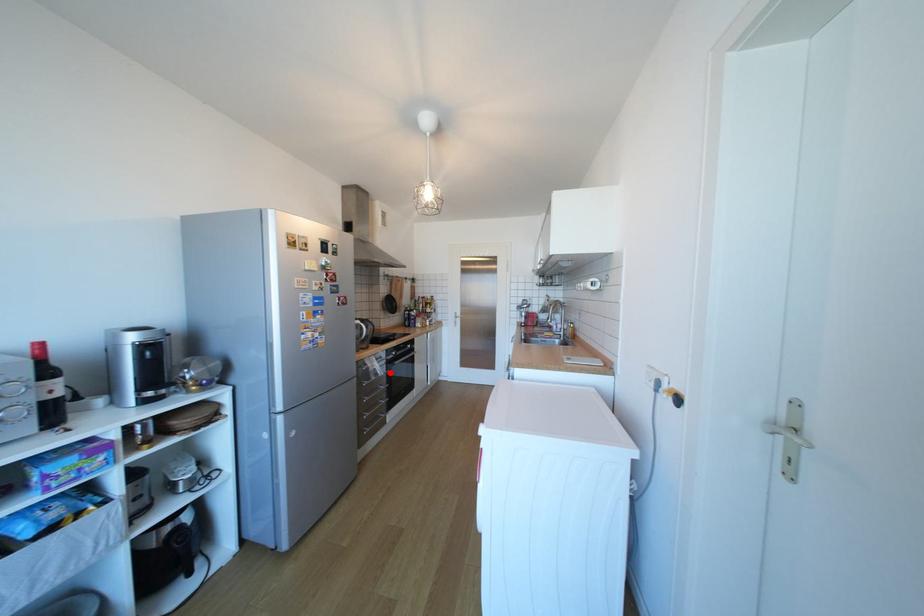
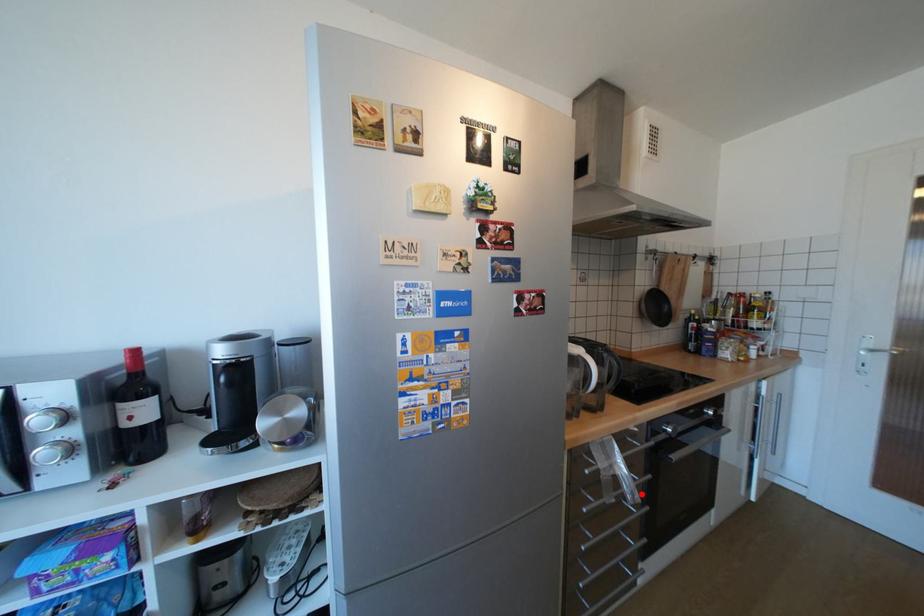
I am providing you with two images of the same scene from different viewpoints. A red point is marked on the first image and another point is marked on the second image. Is the red point in image1 aligned with the point shown in image2?

Yes